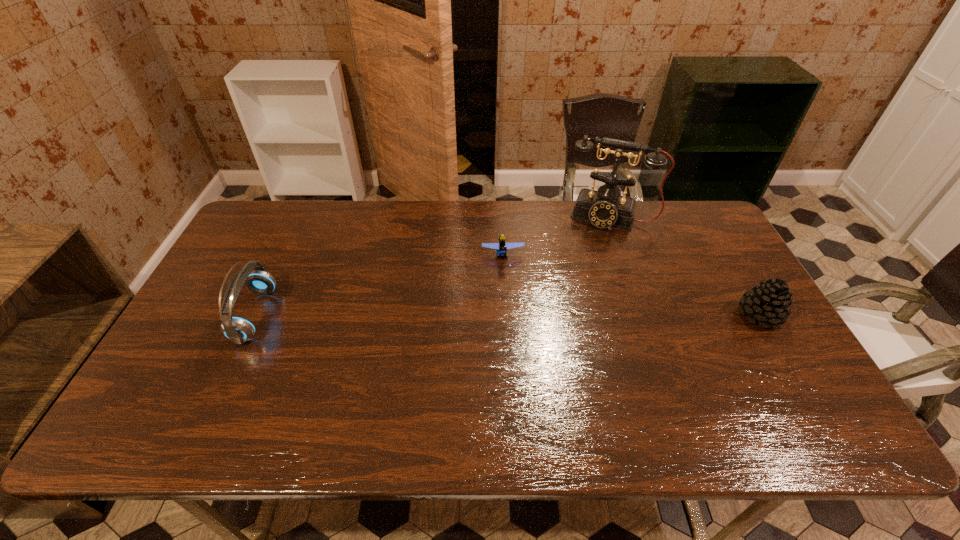
The height and width of the screenshot is (540, 960). Identify the location of the third shortest object. (238, 329).

The width and height of the screenshot is (960, 540). What are the coordinates of `headset` in the screenshot? It's located at (238, 329).

Locate an element on the screen. The image size is (960, 540). pinecone is located at coordinates (768, 303).

Find the location of a particular element. Image resolution: width=960 pixels, height=540 pixels. the rightmost object is located at coordinates (768, 303).

Where is `the third nearest object`? Image resolution: width=960 pixels, height=540 pixels. the third nearest object is located at coordinates (501, 247).

You are a GUI agent. You are given a task and a screenshot of the screen. Output one action in this format:
    pyautogui.click(x=<x>, y=<y>)
    Task: Click on the Lego
    
    Given the screenshot: What is the action you would take?
    pyautogui.click(x=501, y=247)

What are the coordinates of `the third object from left to right` in the screenshot? It's located at (604, 208).

Find the location of a particular element. telephone is located at coordinates (604, 208).

Image resolution: width=960 pixels, height=540 pixels. Identify the location of vacant space situated 0.230m on the ear cups of the second tallest object. (353, 315).

The height and width of the screenshot is (540, 960). Identify the location of vacant space situated 0.210m on the front-facing side of the second object from left to right. (509, 319).